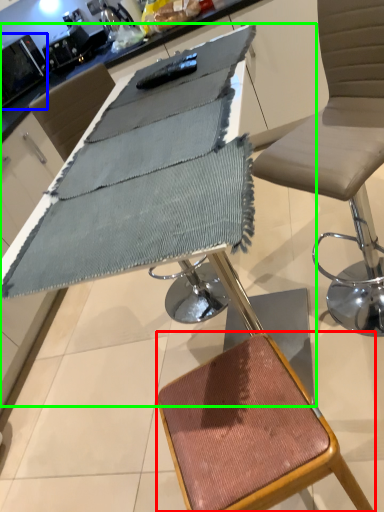
Question: Based on their relative distances, which object is nearer to stool (highlighted by a red box)? Choose from appliance (highlighted by a blue box) and table (highlighted by a green box).

Choices:
 (A) appliance
 (B) table

Answer: (B)